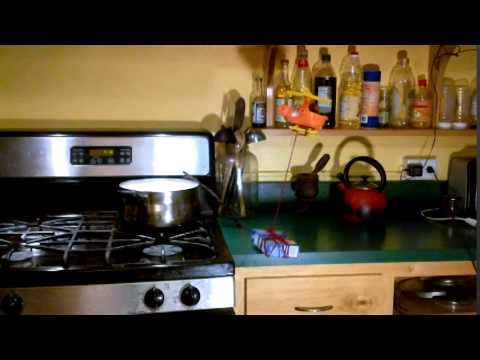
Locate an element on the screen. Image resolution: width=480 pixels, height=360 pixels. pot is located at coordinates (164, 208).